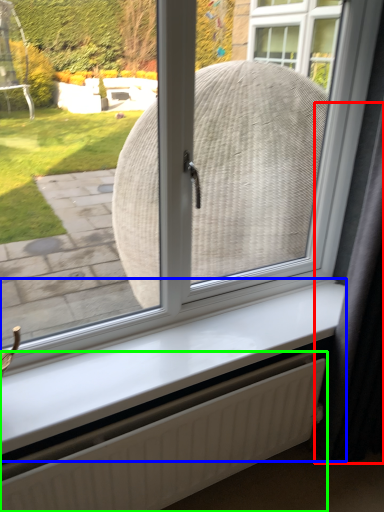
Question: Considering the real-world distances, which object is farthest from curtain (highlighted by a red box)? window sill (highlighted by a blue box) or radiator (highlighted by a green box)?

Choices:
 (A) window sill
 (B) radiator

Answer: (B)